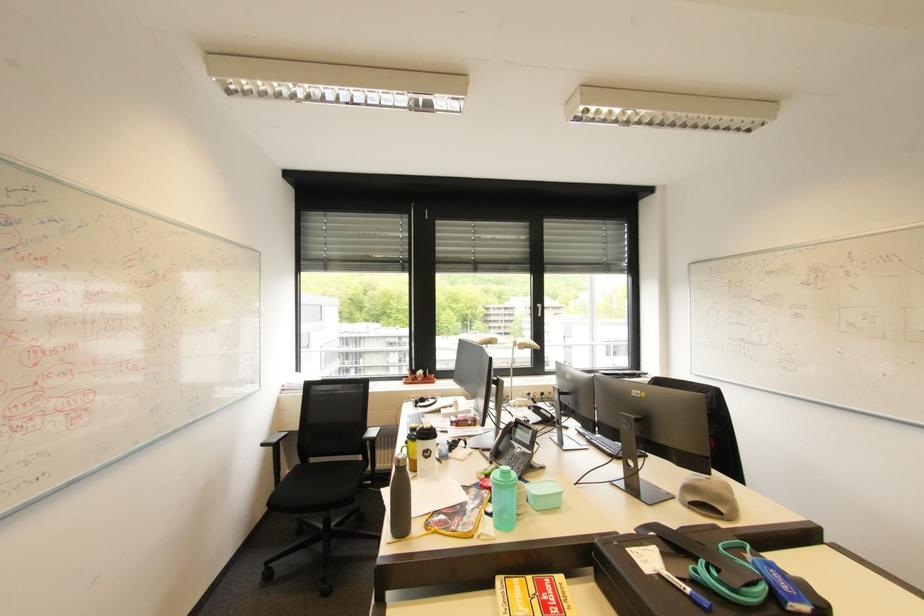
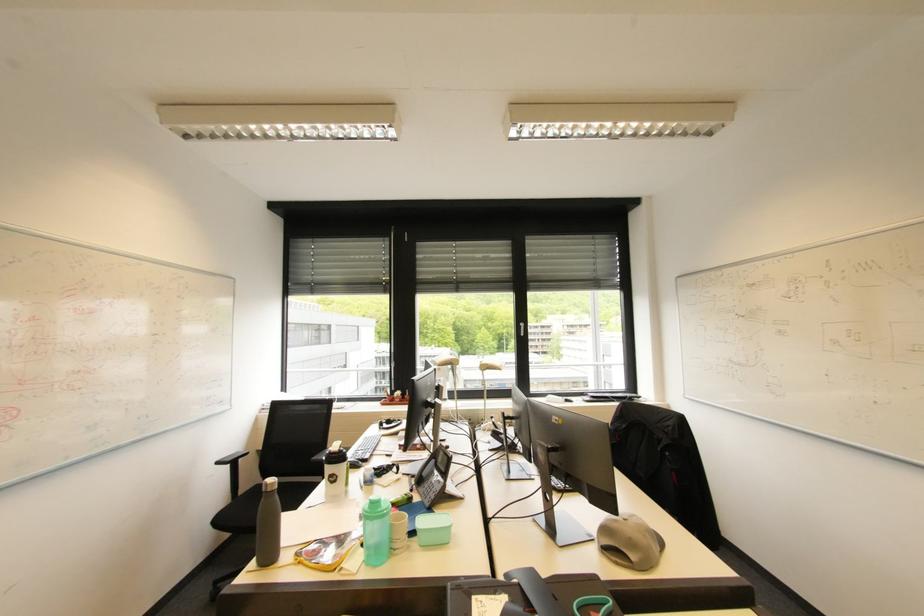
Question: What movement of the cameraman would produce the second image?

Choices:
 (A) Left
 (B) Right
 (C) Forward
 (D) Backward

Answer: (B)